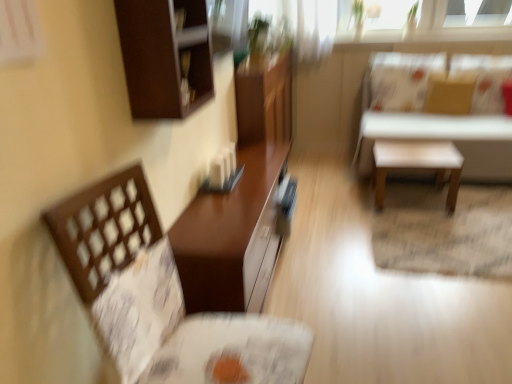
Find the location of a particular element. This screenshot has width=512, height=384. empty space that is to the right of matte brown table at center, the 2th table positioned from the back is located at coordinates pyautogui.click(x=362, y=280).